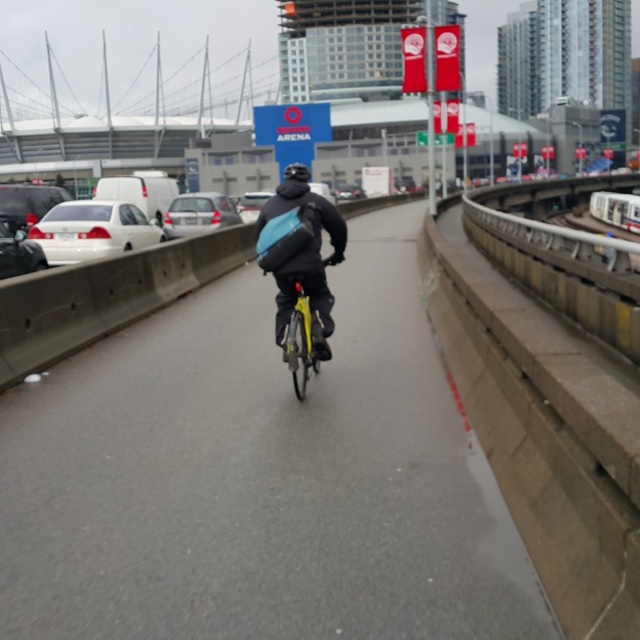
Question: Which object appears closest to the camera in this image?

Choices:
 (A) matte black jacket at center
 (B) yellow matte bicycle at center
 (C) matte black bicycle at center
 (D) white matte sedan at left

Answer: (C)

Question: Is white matte sedan at left below silver metallic sedan at center?

Choices:
 (A) no
 (B) yes

Answer: (B)

Question: Does matte black jacket at center lie in front of yellow matte bicycle at center?

Choices:
 (A) yes
 (B) no

Answer: (A)

Question: Which point is closer to the camera?

Choices:
 (A) white matte sedan at left
 (B) silver metallic sedan at center

Answer: (A)

Question: Which of the following is the farthest from the observer?

Choices:
 (A) (260, 257)
 (B) (83, 214)
 (C) (209, 196)
 (D) (125, 524)

Answer: (C)

Question: Is matte black jacket at center thinner than silver metallic sedan at center?

Choices:
 (A) no
 (B) yes

Answer: (B)